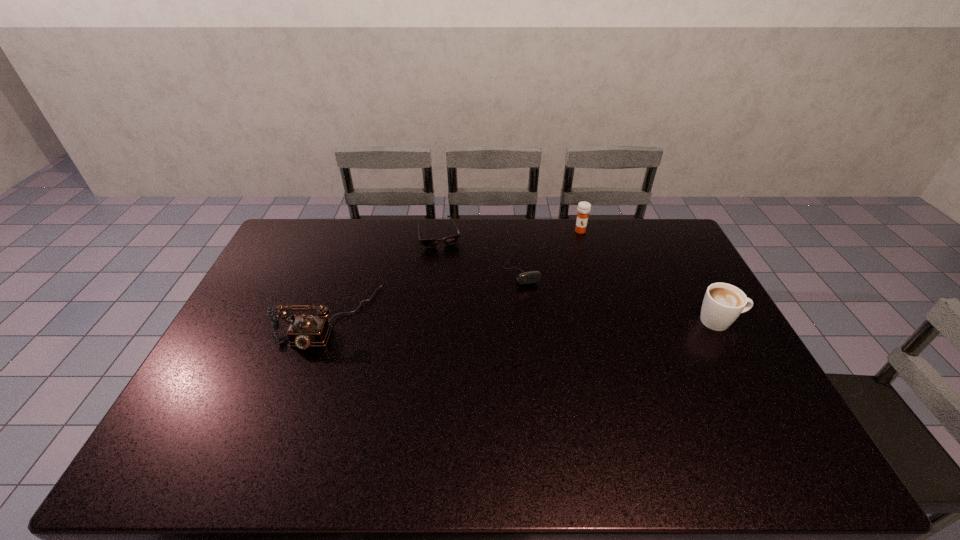
This screenshot has width=960, height=540. In order to click on free space that is in between the leftmost object and the cappuccino in this screenshot , I will do `click(524, 320)`.

Where is `free space between the rightmost object and the fourth object from left to right`? free space between the rightmost object and the fourth object from left to right is located at coordinates (650, 276).

Where is `vacant region between the sunglasses and the third object from left to right`? This screenshot has width=960, height=540. vacant region between the sunglasses and the third object from left to right is located at coordinates (480, 251).

This screenshot has height=540, width=960. What are the coordinates of `vacant area that lies between the second shortest object and the shortest object` in the screenshot? It's located at (480, 251).

The height and width of the screenshot is (540, 960). I want to click on empty space that is in between the webcam and the leftmost object, so click(424, 292).

Identify the location of blank region between the medicine and the second shortest object. The width and height of the screenshot is (960, 540). (550, 248).

Where is `free point between the second shortest object and the cappuccino`? The width and height of the screenshot is (960, 540). free point between the second shortest object and the cappuccino is located at coordinates (620, 294).

Where is `free spot between the medicine and the cappuccino`? free spot between the medicine and the cappuccino is located at coordinates (650, 276).

Where is `object that can be found as the second closest to the sunglasses`? The height and width of the screenshot is (540, 960). object that can be found as the second closest to the sunglasses is located at coordinates (304, 331).

Identify the location of the closest object to the telephone. (432, 242).